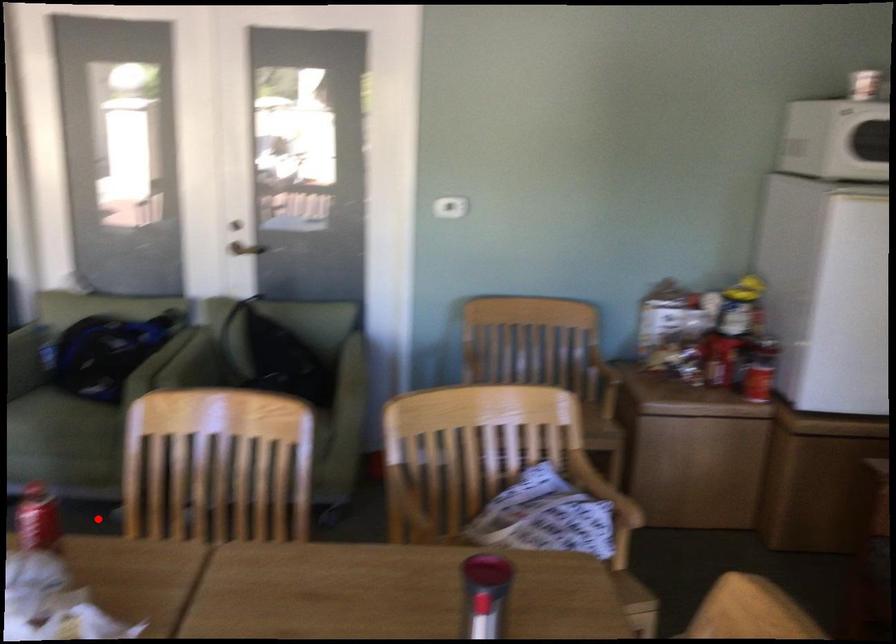
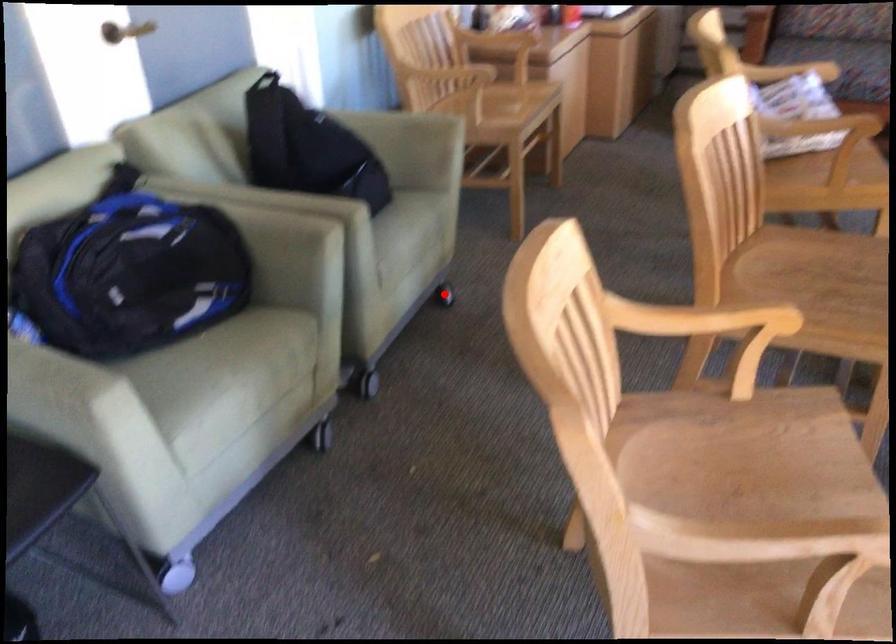
I am providing you with two images of the same scene from different viewpoints. A red point is marked on the first image and another point is marked on the second image. Do the highlighted points in image1 and image2 indicate the same real-world spot?

No